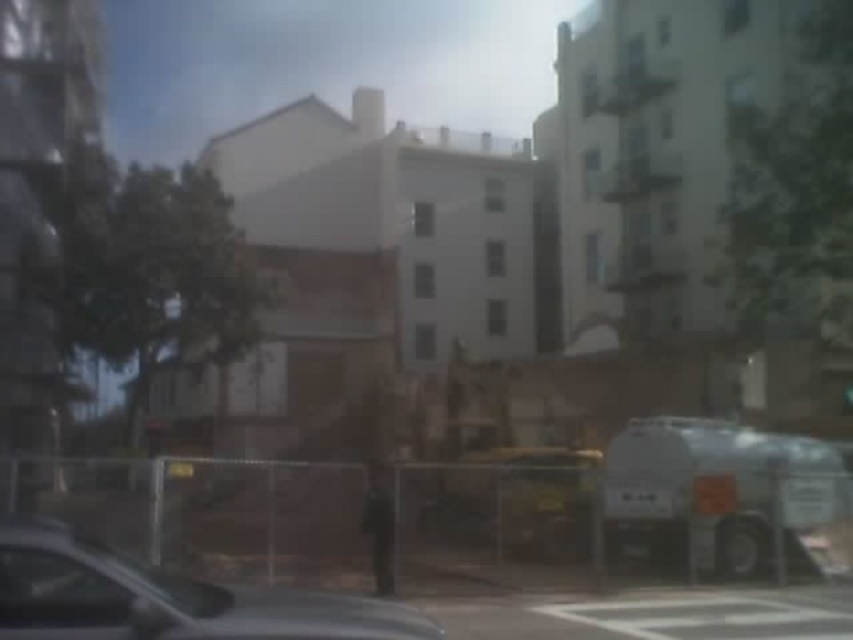
You are a pedestrian standing at the crosswalk in the scene. You want to cross the street safely. Which vehicle, the metallic silver car at lower left or the white matte truck at lower right, is closer to you as you stand on the crosswalk?

The metallic silver car at lower left is closer to you because it is in front of the white matte truck at lower right, meaning it is positioned nearer to your location on the crosswalk.

You are a pedestrian crossing the street and see the metallic silver car at lower left and the white matte truck at lower right. Which vehicle is closer to the crosswalk?

The metallic silver car at lower left is closer to the crosswalk because it is positioned on the left side of the white matte truck at lower right, which is further away from the crosswalk.

You are standing at the construction site and want to determine which of the two points, point (271, 604) or point (732, 573), is closer to you. Based on the scene description, which point is nearer?

Point (271, 604) is closer to the viewer than point (732, 573).